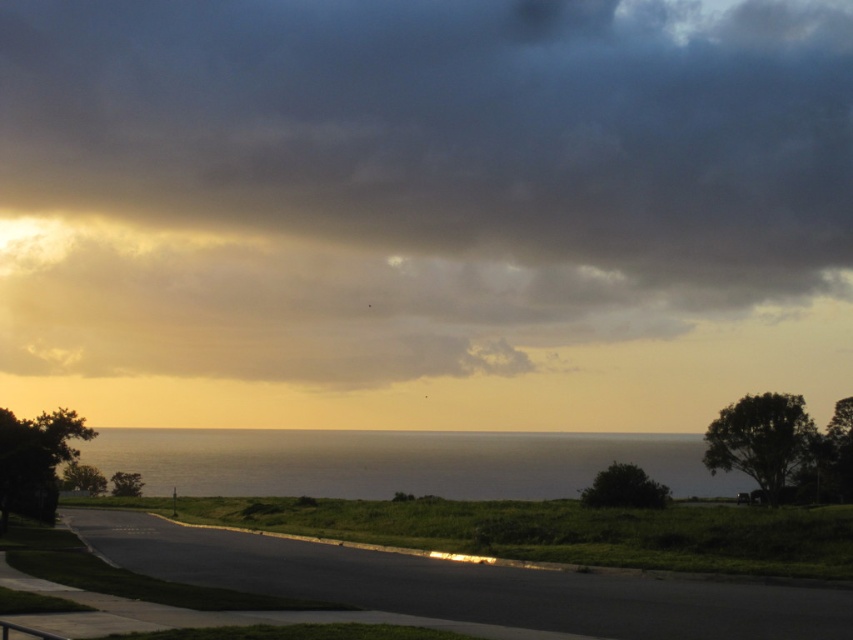
Is dark gray cloud at upper center shorter than olive green water at center?

No.

Does dark gray cloud at upper center come in front of olive green water at center?

No, dark gray cloud at upper center is behind olive green water at center.

Who is more forward, (596, 268) or (535, 458)?

Point (535, 458) is in front.

The width and height of the screenshot is (853, 640). I want to click on dark gray cloud at upper center, so click(x=410, y=180).